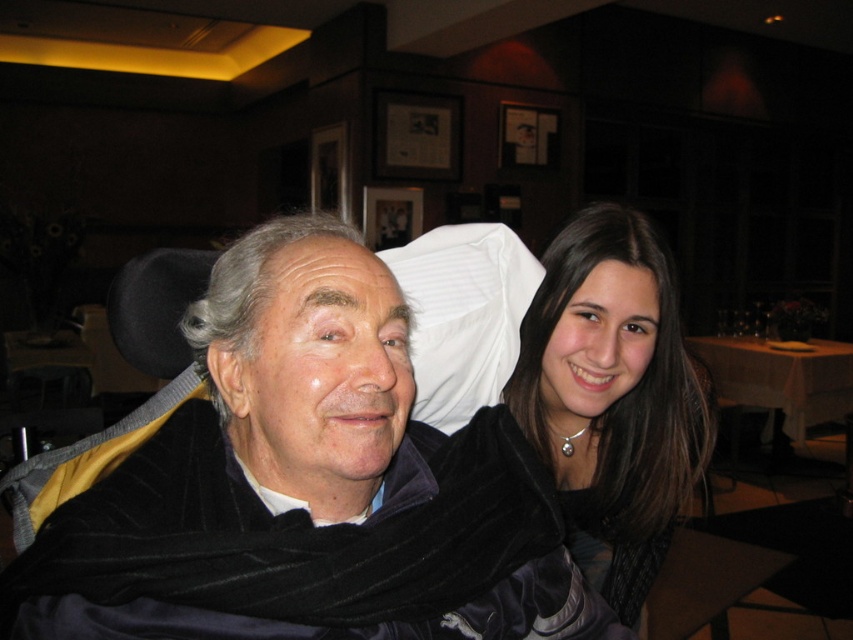
Where is the velvet black jacket at center located in the image?

The velvet black jacket at center is located at point (277, 460).

You are a fashion designer observing the velvet black jackets in the image. Which one is wider, the velvet black jacket at center or the velvet black jacket at upper right?

The velvet black jacket at center is wider than the velvet black jacket at upper right.

You are a photographer standing in the restaurant and want to capture a closeup of the younger woman. You have two points marked in the scene for focus adjustment. The first point is at coordinate point (676, 516) and the second point is at coordinate point (822, 413). Which point should you focus on to ensure the younger woman is in focus?

Point (676, 516) is closer to the viewer than point (822, 413). Therefore, focusing on point (676, 516) will ensure the younger woman is in focus since it is closer to you.